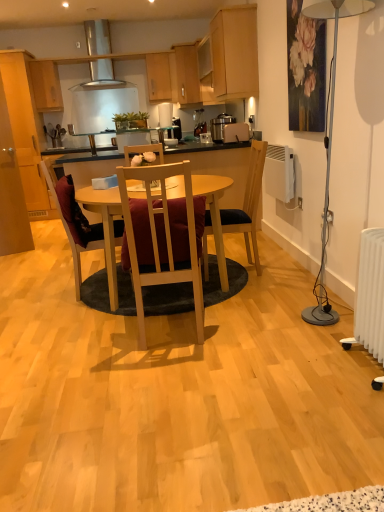
At what (x,y) coordinates should I click in order to perform the action: click on free space in front of light wood table at center. Please return your answer as a coordinate pair (x, y). This screenshot has width=384, height=512. Looking at the image, I should click on (169, 374).